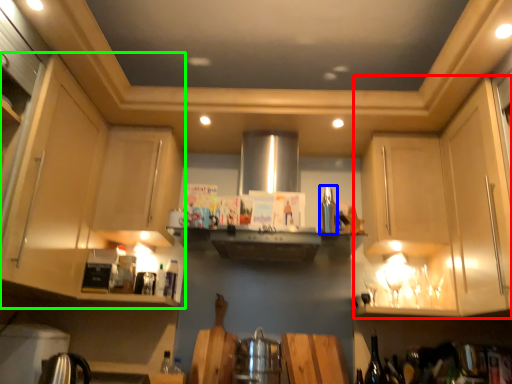
Question: Estimate the real-world distances between objects in this image. Which object is closer to cabinetry (highlighted by a red box), appliance (highlighted by a blue box) or cabinetry (highlighted by a green box)?

Choices:
 (A) appliance
 (B) cabinetry

Answer: (A)